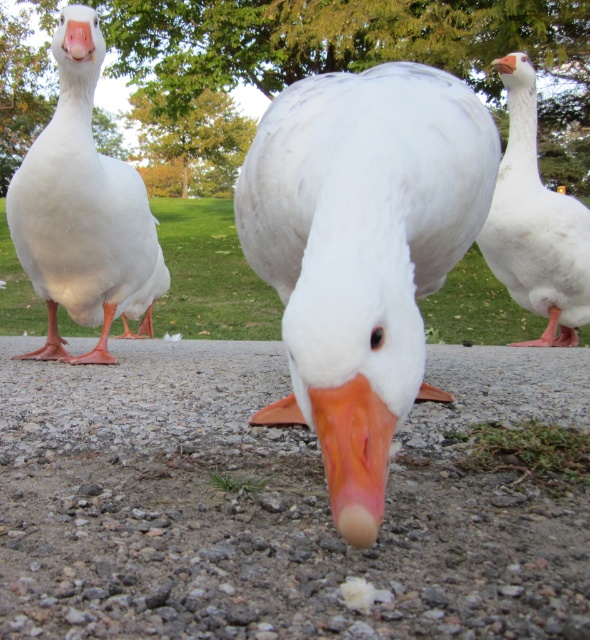
Question: Does white matte duck at center have a greater width compared to pink matte beak at center?

Choices:
 (A) yes
 (B) no

Answer: (A)

Question: Which point is farther to the camera?

Choices:
 (A) (333, 458)
 (B) (536, 204)
 (C) (77, 22)
 (D) (441, 528)

Answer: (B)

Question: Can you confirm if white matte duck at center is positioned to the right of orange matte beak at center?

Choices:
 (A) yes
 (B) no

Answer: (A)

Question: Does white matte duck at center have a larger size compared to matte white duck at left?

Choices:
 (A) no
 (B) yes

Answer: (A)

Question: Considering the real-world distances, which object is closest to the white matte duck at center?

Choices:
 (A) white matte goose at upper right
 (B) matte white duck at left

Answer: (B)

Question: Among these objects, which one is farthest from the camera?

Choices:
 (A) orange matte beak at center
 (B) matte white duck at left
 (C) white matte duck at center

Answer: (B)